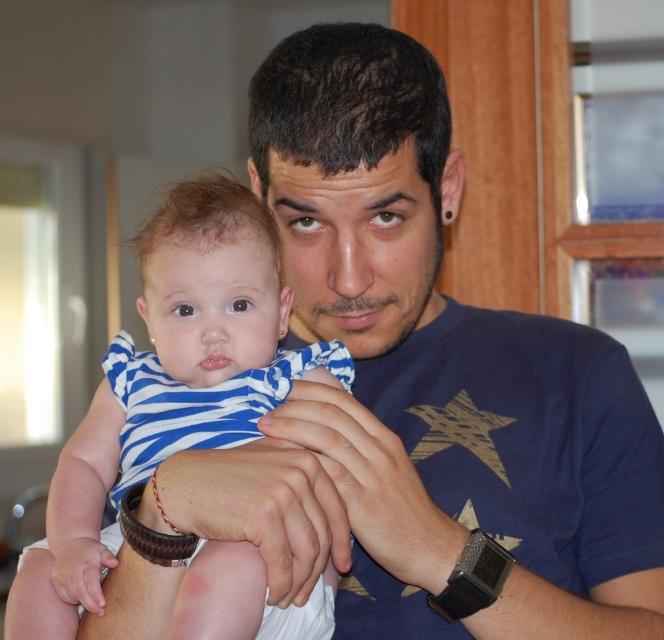
You are a photographer setting up for a portrait. You want to ensure both the blue striped fabric baby at center and the black leather watch at center are in focus. The camera lens has a depth of field that can cover 6 inches. Will both subjects be in focus?

The distance between the blue striped fabric baby at center and the black leather watch at center is 6.11 inches. Since the depth of field can only cover 6 inches, the camera might not capture both subjects in focus simultaneously.

You are a photographer trying to capture the perfect shot of the blue striped fabric baby at center and the black leather watch at center. Since you want to ensure both subjects are in focus, you need to know which one is wider. Which object has a greater width?

The black leather watch at center has a greater width than the blue striped fabric baby at center because the description states that the baby is less wide than the watch.

You are a photographer setting up for a closeup shot of the baby in the image. You have two points marked on your viewfinder at coordinates point (258, 365) and point (394, 435). Which point is closer to the camera?

Point (258, 365) is further to the camera than point (394, 435), so the closer point to the camera is point (258, 365).